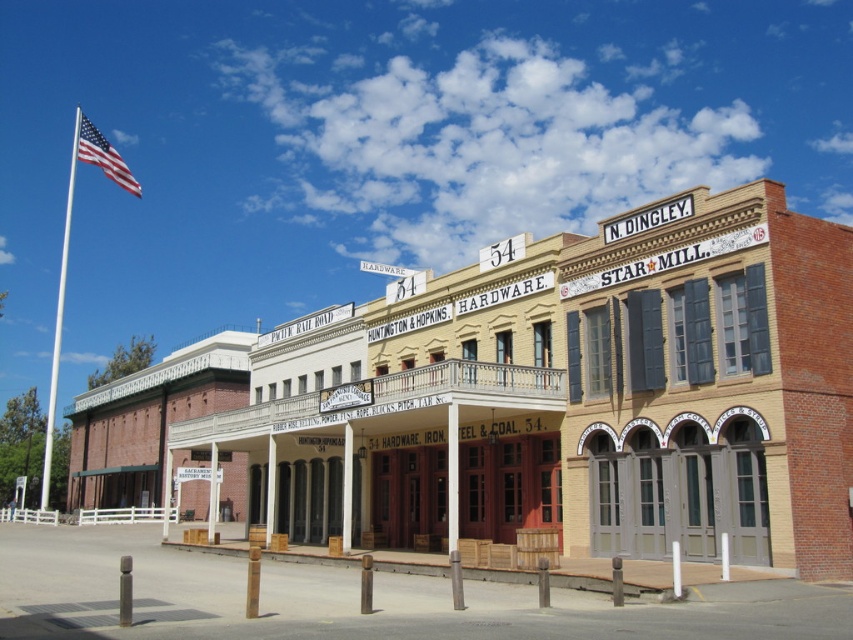
You are standing in front of the historic buildings and want to take a photo that includes both the brick building at center and the white metallic flag pole at left. Which object will appear taller in the photo?

The white metallic flag pole at left appears taller in the photo because it is taller than the brick building at center.

You are standing in front of the historic buildings and notice the brick building at center and the white metallic flag pole at left. Which one is positioned lower in the scene?

The brick building at center is positioned lower than the white metallic flag pole at left as it is below it.